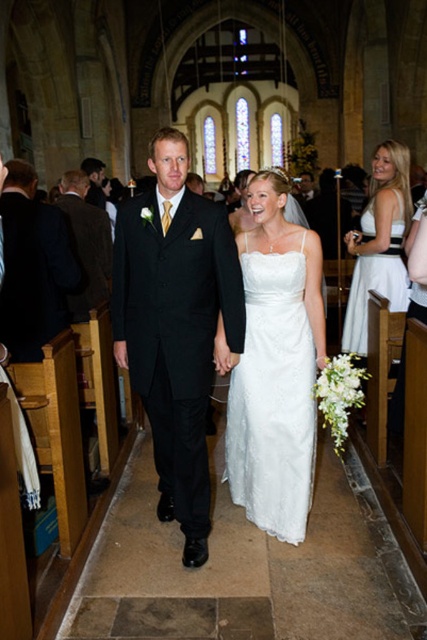
Question: Can you confirm if polished stone aisle at center is positioned to the right of white satin dress at right?

Choices:
 (A) no
 (B) yes

Answer: (A)

Question: Which object is farther from the camera taking this photo?

Choices:
 (A) polished stone aisle at center
 (B) white lace dress at center
 (C) shiny black suit at center
 (D) black satin suit at center

Answer: (C)

Question: Which point is farther to the camera?

Choices:
 (A) shiny black suit at center
 (B) polished stone aisle at center

Answer: (A)

Question: Is white lace dress at center below white satin dress at right?

Choices:
 (A) no
 (B) yes

Answer: (B)

Question: Is black satin suit at center positioned before brown wool suit at left?

Choices:
 (A) no
 (B) yes

Answer: (B)

Question: Which point appears farthest from the camera in this image?

Choices:
 (A) (81, 227)
 (B) (142, 220)

Answer: (A)